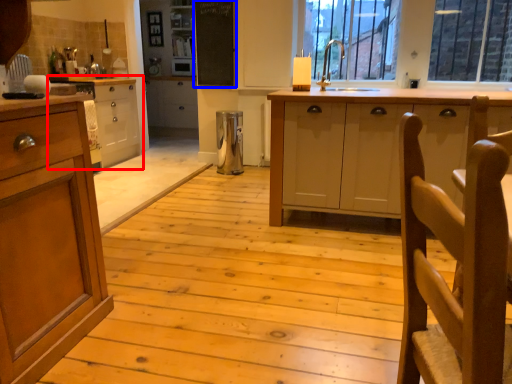
Question: Which point is closer to the camera, cabinetry (highlighted by a red box) or bulletin board (highlighted by a blue box)?

Choices:
 (A) cabinetry
 (B) bulletin board

Answer: (A)